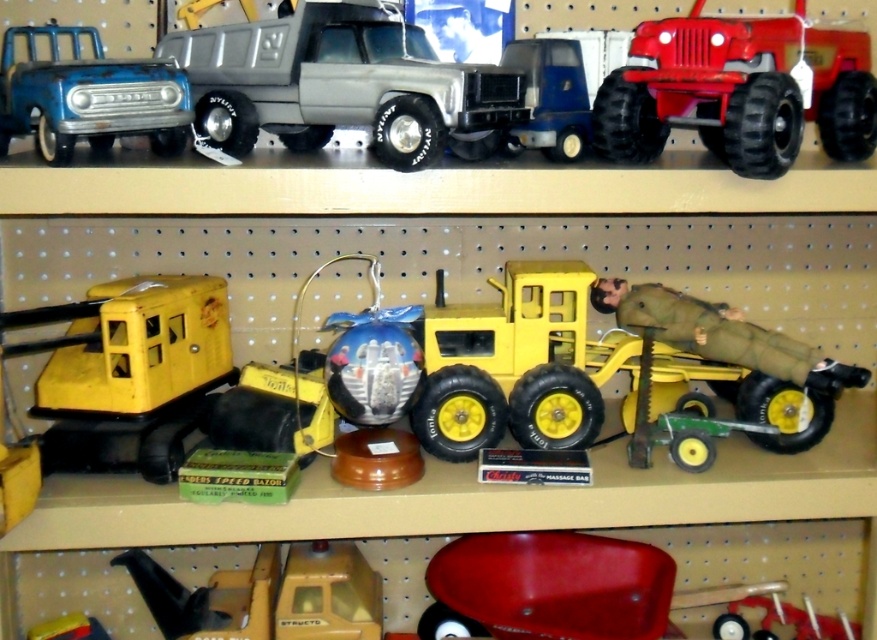
Question: Which object appears farthest from the camera in this image?

Choices:
 (A) yellow matte truck at center
 (B) matte plastic truck at center
 (C) matte blue truck at upper left

Answer: (A)

Question: Among these points, which one is farthest from the camera?

Choices:
 (A) (293, 637)
 (B) (73, 60)

Answer: (A)

Question: Is yellow matte truck at center smaller than matte blue truck at upper left?

Choices:
 (A) yes
 (B) no

Answer: (B)

Question: Among these objects, which one is nearest to the camera?

Choices:
 (A) yellow matte truck at center
 (B) matte blue truck at upper left
 (C) shiny red plastic jeep at upper right
 (D) matte plastic truck at center

Answer: (C)

Question: Is matte plastic truck at center bigger than shiny red plastic jeep at upper right?

Choices:
 (A) no
 (B) yes

Answer: (B)

Question: Is matte plastic truck at center wider than shiny red plastic jeep at upper right?

Choices:
 (A) no
 (B) yes

Answer: (B)